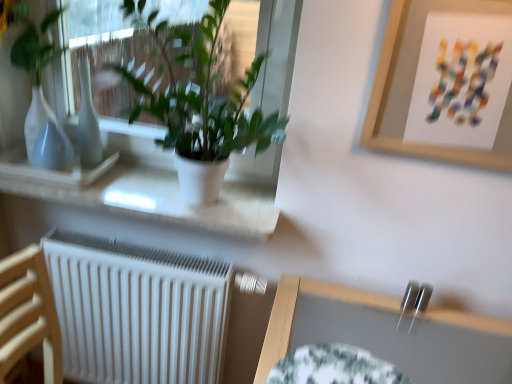
Question: In terms of size, does white matte plant pot at upper left, which is the first houseplant in right-to-left order, appear bigger or smaller than white glossy vase at left, which is the 1th houseplant from left to right?

Choices:
 (A) small
 (B) big

Answer: (B)

Question: From the image's perspective, is white matte plant pot at upper left, acting as the 2th houseplant starting from the left, located above or below white glossy vase at left, the 2th houseplant when ordered from right to left?

Choices:
 (A) below
 (B) above

Answer: (A)

Question: Which object is positioned farthest from the white matte window sill at upper left?

Choices:
 (A) white glossy vase at left, which is the 1th houseplant from left to right
 (B) white matte radiator at lower left
 (C) matte white vase at left, acting as the second vase starting from the right
 (D) white glossy vase at upper left, the first vase when ordered from right to left
 (E) wooden picture frame at upper right

Answer: (E)

Question: Which object is the farthest from the white matte plant pot at upper left, which is the first houseplant in right-to-left order?

Choices:
 (A) white matte radiator at lower left
 (B) white matte window sill at upper left
 (C) white glossy vase at left, the 2th houseplant when ordered from right to left
 (D) wooden picture frame at upper right
 (E) matte white vase at left, the 1th vase in the left-to-right sequence

Answer: (A)